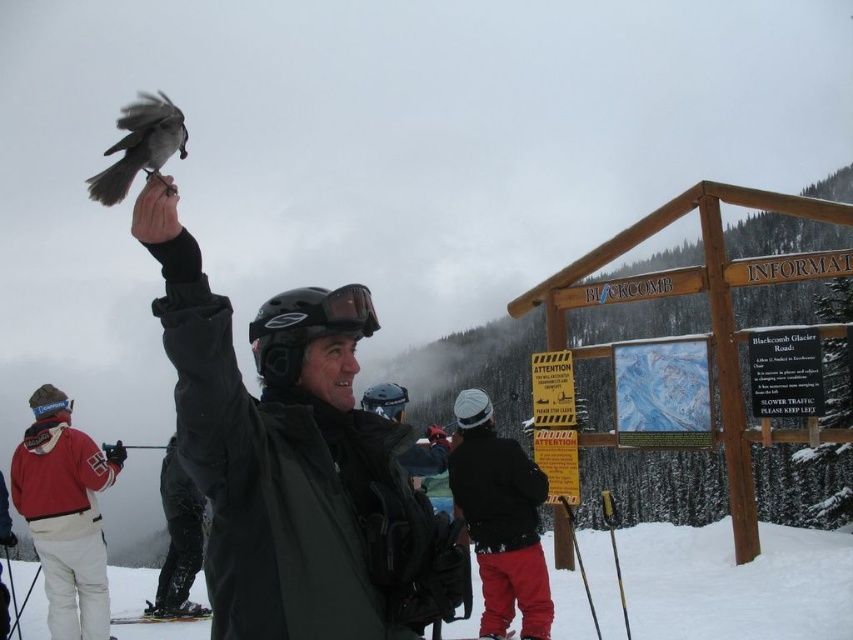
Consider the image. Between gray matte bird at upper left and black matte goggles at upper center, which one has less height?

black matte goggles at upper center

Can you confirm if gray matte bird at upper left is positioned to the right of black matte goggles at upper center?

No, gray matte bird at upper left is not to the right of black matte goggles at upper center.

Who is more distant from viewer, (126, 120) or (279, 332)?

The point (126, 120) is behind.

At what (x,y) coordinates should I click in order to perform the action: click on gray matte bird at upper left. Please return your answer as a coordinate pair (x, y). This screenshot has width=853, height=640. Looking at the image, I should click on (140, 145).

Find the location of a particular element. Image resolution: width=853 pixels, height=640 pixels. matte black jacket at upper left is located at coordinates (285, 452).

Is point (335, 456) more distant than point (645, 580)?

No, (335, 456) is closer to viewer.

Identify the location of matte black jacket at upper left. (285, 452).

Is red fleece jacket at lower left smaller than black matte snow pants at lower left?

Incorrect, red fleece jacket at lower left is not smaller in size than black matte snow pants at lower left.

Is red fleece jacket at lower left wider than black matte snow pants at lower left?

Yes, red fleece jacket at lower left is wider than black matte snow pants at lower left.

Is point (35, 508) closer to camera compared to point (178, 529)?

That is True.

Where is `red fleece jacket at lower left`? The width and height of the screenshot is (853, 640). red fleece jacket at lower left is located at coordinates (65, 513).